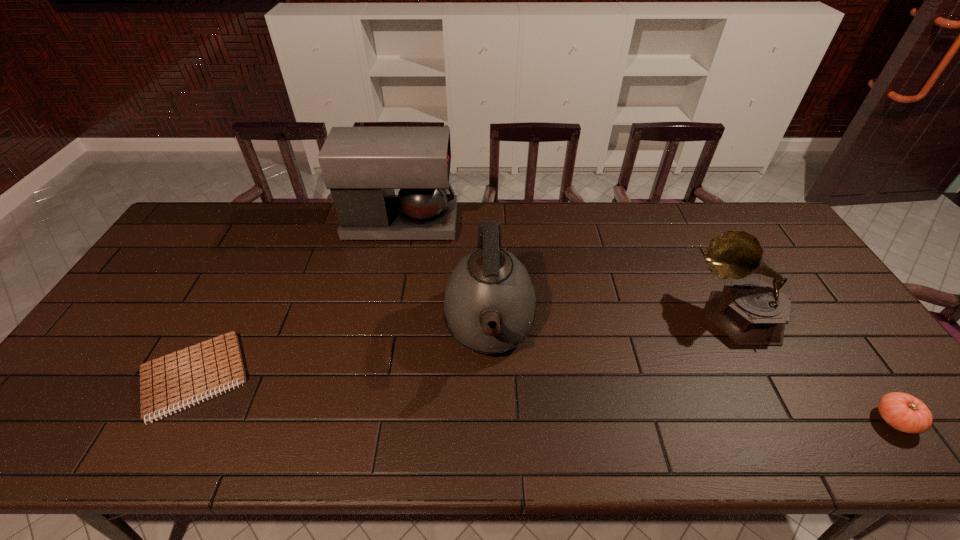
You are a GUI agent. You are given a task and a screenshot of the screen. Output one action in this format:
    pyautogui.click(x=<x>, y=<y>)
    Task: Click on the free space between the fourth tallest object and the kettle
    
    Given the screenshot: What is the action you would take?
    pyautogui.click(x=692, y=374)

Find the location of a particular element. Image resolution: width=960 pixels, height=540 pixels. free spot between the coffee maker and the kettle is located at coordinates (445, 275).

Find the location of a particular element. The height and width of the screenshot is (540, 960). free area in between the farthest object and the tomato is located at coordinates (x=648, y=322).

Identify the location of vacant area between the kettle and the rightmost object. (692, 374).

Where is `object that stands as the fourth closest to the coffee maker`? Image resolution: width=960 pixels, height=540 pixels. object that stands as the fourth closest to the coffee maker is located at coordinates [903, 412].

The height and width of the screenshot is (540, 960). I want to click on object that ranks as the fourth closest to the third shortest object, so click(171, 382).

This screenshot has width=960, height=540. In order to click on free space that satisfies the following two spatial constraints: 1. on the back side of the tomato; 2. on the carafe side of the coffee maker in this screenshot , I will do `click(756, 224)`.

The image size is (960, 540). In order to click on free space that satisfies the following two spatial constraints: 1. on the back side of the fourth tallest object; 2. on the carafe side of the coffee maker in this screenshot , I will do `click(756, 224)`.

Locate an element on the screen. Image resolution: width=960 pixels, height=540 pixels. free space that satisfies the following two spatial constraints: 1. at the spout of the tomato; 2. on the left side of the kettle is located at coordinates tap(492, 420).

I want to click on free region that satisfies the following two spatial constraints: 1. on the carafe side of the fourth tallest object; 2. on the left side of the coffee maker, so click(x=361, y=420).